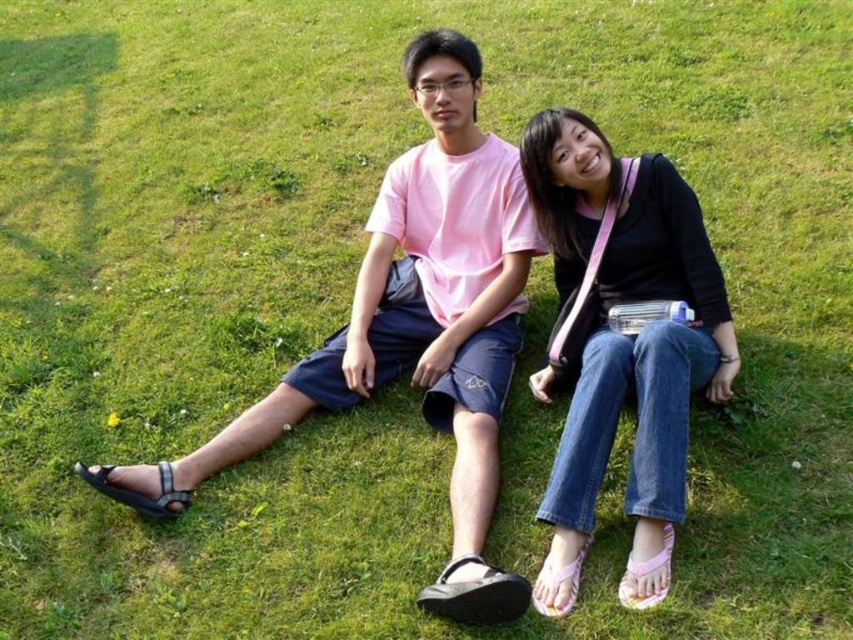
Question: In this image, where is denim jeans at center located relative to black rubber sandal at lower left?

Choices:
 (A) right
 (B) left

Answer: (A)

Question: Which object is closer to the camera taking this photo?

Choices:
 (A) pink fabric sandal at lower right
 (B) black rubber sandal at lower left

Answer: (A)

Question: Can you confirm if black rubber sandal at lower center is thinner than pink fabric sandal at lower center?

Choices:
 (A) no
 (B) yes

Answer: (A)

Question: Among these objects, which one is farthest from the camera?

Choices:
 (A) black rubber sandal at lower center
 (B) pink fabric sandal at lower right
 (C) pink fabric sandal at lower center

Answer: (C)

Question: Is denim jeans at center above pink fabric sandal at lower center?

Choices:
 (A) yes
 (B) no

Answer: (A)

Question: Among these objects, which one is farthest from the camera?

Choices:
 (A) denim jeans at center
 (B) pink fabric sandal at lower right

Answer: (A)